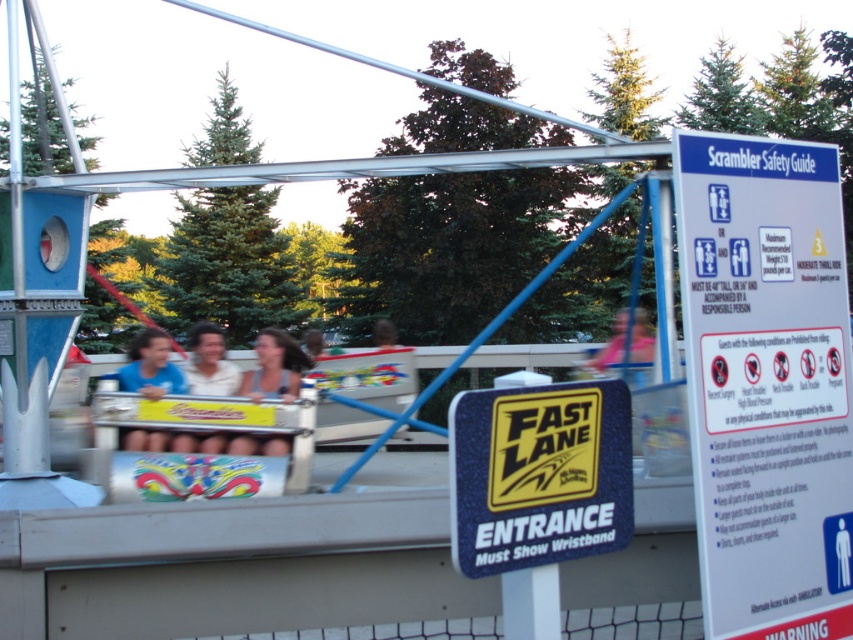
Question: Which object appears closest to the camera in this image?

Choices:
 (A) white paper sign at upper right
 (B) matte white shirt at center

Answer: (A)

Question: Is pink fabric at center wider than matte white shirt at center?

Choices:
 (A) yes
 (B) no

Answer: (A)

Question: Estimate the real-world distances between objects in this image. Which object is closer to the light brown hair at center?

Choices:
 (A) blue plastic sign at center
 (B) matte blue shirt at center
 (C) smooth brown hair at center

Answer: (B)

Question: Among these points, which one is nearest to the camera?

Choices:
 (A) (747, 618)
 (B) (386, 323)

Answer: (A)

Question: Is blue plastic sign at center bigger than light brown hair at center?

Choices:
 (A) yes
 (B) no

Answer: (B)

Question: Considering the relative positions of light brown hair at center and pink fabric at center in the image provided, where is light brown hair at center located with respect to pink fabric at center?

Choices:
 (A) above
 (B) below

Answer: (B)